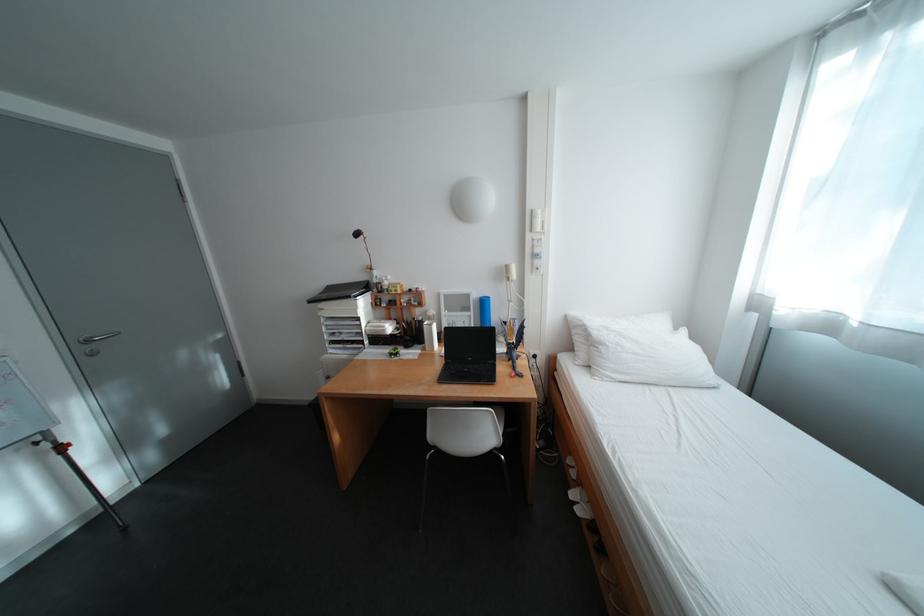
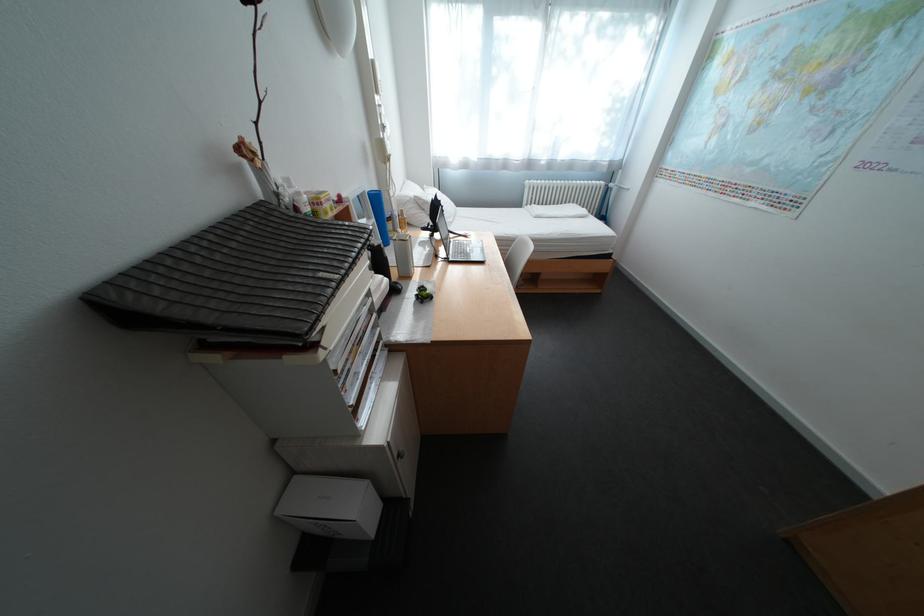
Locate, in the second image, the point that corresponds to point 592,323 in the first image.

(420, 200)